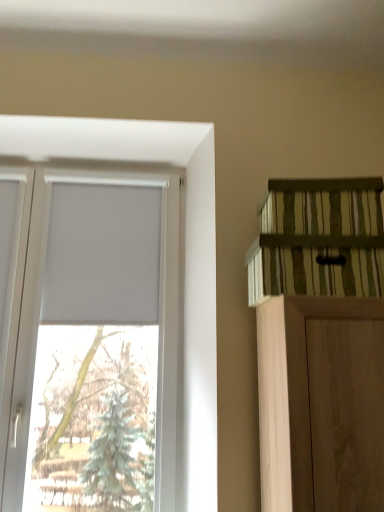
Question: Is white matte window at upper left taller than green striped wood shelf at upper right?

Choices:
 (A) yes
 (B) no

Answer: (A)

Question: Does white matte window at upper left turn towards green striped wood shelf at upper right?

Choices:
 (A) no
 (B) yes

Answer: (A)

Question: Is white matte window at upper left outside of green striped wood shelf at upper right?

Choices:
 (A) no
 (B) yes

Answer: (B)

Question: Is white matte window at upper left at the right side of green striped wood shelf at upper right?

Choices:
 (A) yes
 (B) no

Answer: (B)

Question: Is white matte window at upper left wider than green striped wood shelf at upper right?

Choices:
 (A) no
 (B) yes

Answer: (A)

Question: From a real-world perspective, does white matte window at upper left stand above green striped wood shelf at upper right?

Choices:
 (A) yes
 (B) no

Answer: (B)

Question: Is green striped wood shelf at upper right oriented away from white matte window at upper left?

Choices:
 (A) yes
 (B) no

Answer: (B)

Question: From the image's perspective, does green striped wood shelf at upper right appear higher than white matte window at upper left?

Choices:
 (A) yes
 (B) no

Answer: (A)

Question: Can we say green striped wood shelf at upper right lies outside white matte window at upper left?

Choices:
 (A) yes
 (B) no

Answer: (A)

Question: Considering the relative positions of green striped wood shelf at upper right and white matte window at upper left in the image provided, is green striped wood shelf at upper right to the right of white matte window at upper left from the viewer's perspective?

Choices:
 (A) no
 (B) yes

Answer: (B)

Question: From a real-world perspective, does green striped wood shelf at upper right sit lower than white matte window at upper left?

Choices:
 (A) no
 (B) yes

Answer: (A)

Question: Is green striped wood shelf at upper right not close to white matte window at upper left?

Choices:
 (A) yes
 (B) no

Answer: (B)

Question: Looking at their shapes, would you say white matte window at upper left is wider or thinner than green striped wood shelf at upper right?

Choices:
 (A) thin
 (B) wide

Answer: (A)